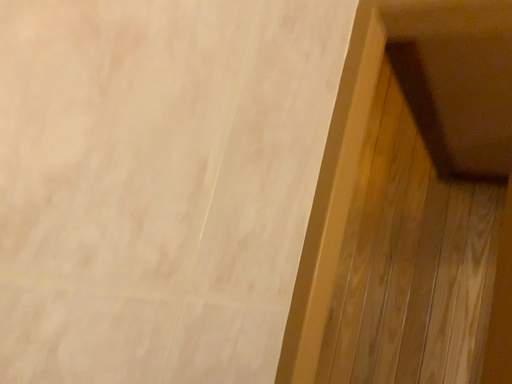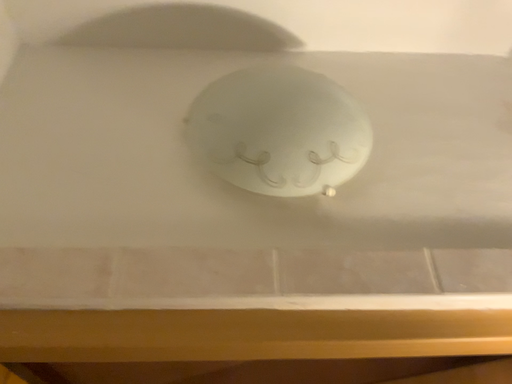
Question: Which way did the camera rotate in the video?

Choices:
 (A) rotated downward
 (B) rotated upward

Answer: (B)